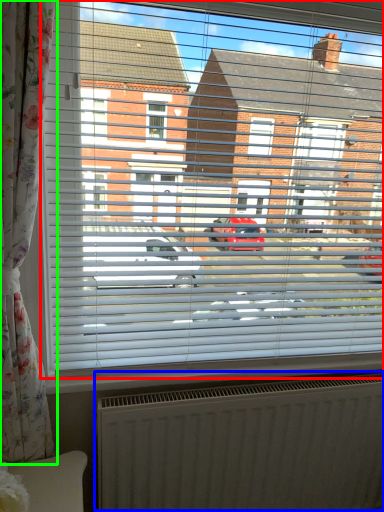
Question: Based on their relative distances, which object is nearer to window (highlighted by a red box)? Choose from radiator (highlighted by a blue box) and curtain (highlighted by a green box).

Choices:
 (A) radiator
 (B) curtain

Answer: (B)